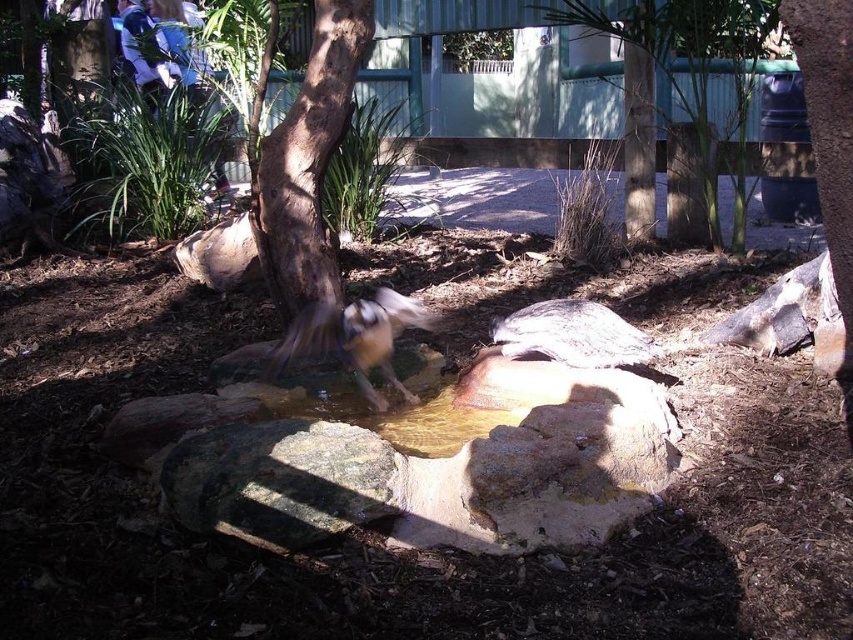
You are a bird perched on the brown rough bark tree at center and want to fly to the brown textured tree at upper center. Which direction should you fly to reach your destination?

The brown textured tree at upper center is taller than the brown rough bark tree at center, so you should fly upward and toward the center of the scene to reach it.

You are a visitor at the zoo and want to take a photo of the gray textured turtle at center without including the brown textured tree at upper center in the frame. Is it possible to do so by adjusting your camera angle?

The brown textured tree at upper center is positioned over the gray textured turtle at center, so adjusting the camera angle downward might allow you to exclude the tree from the photo while still capturing the turtle.

You are a visitor at the zoo observing the brown textured tree at upper center and the gray textured turtle at center. Which object is positioned to the right side of the other?

The brown textured tree at upper center is positioned to the right of the gray textured turtle at center.